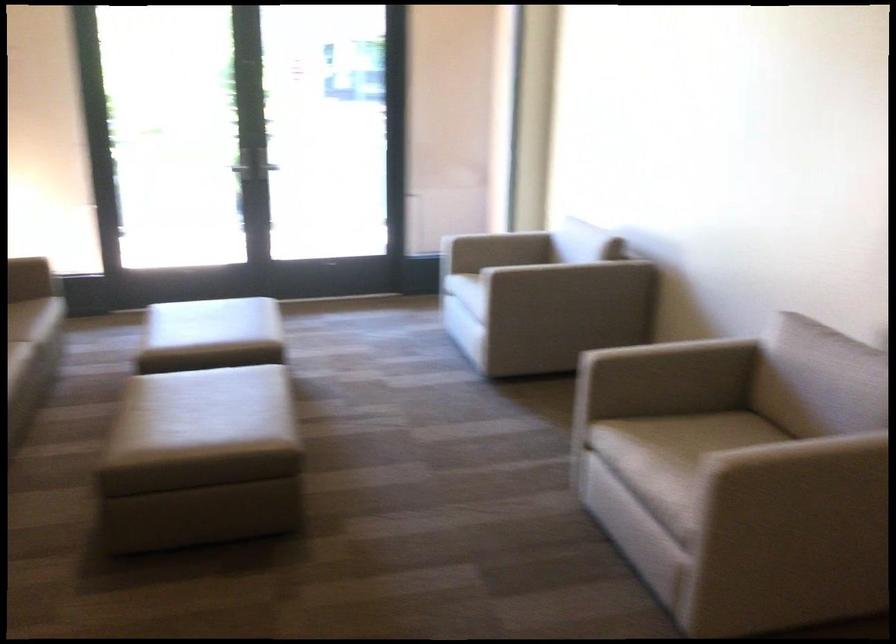
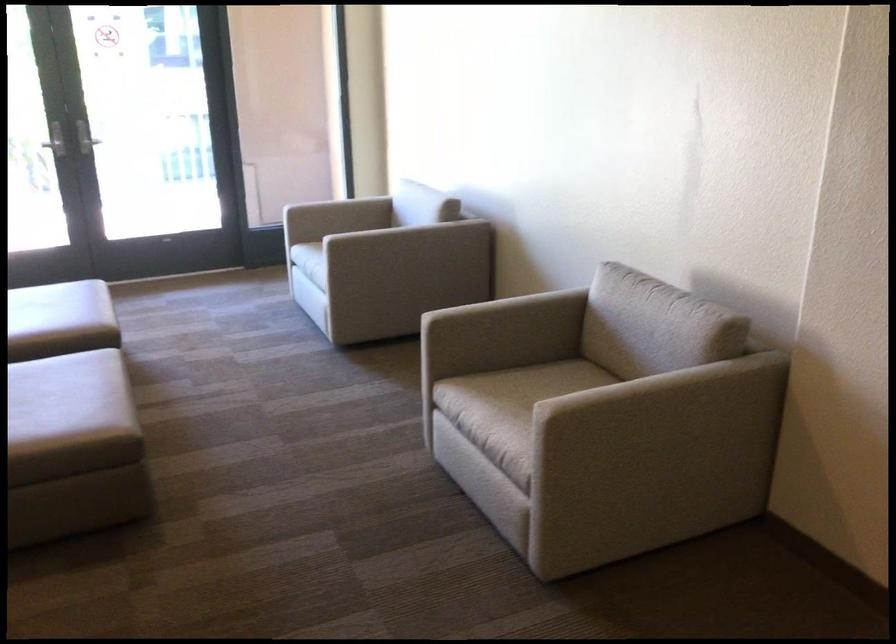
Question: What movement of the cameraman would produce the second image?

Choices:
 (A) Left
 (B) Right
 (C) Forward
 (D) Backward

Answer: (B)